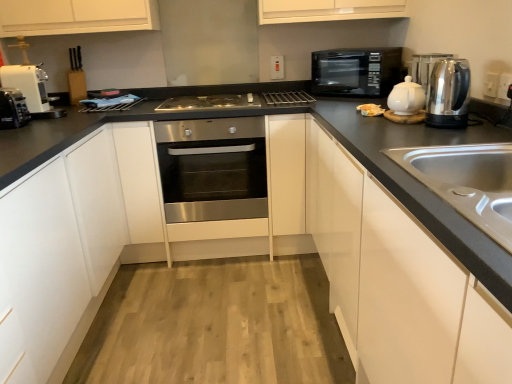
Question: Is white plastic toaster at left facing away from white plastic electric outlet at upper center, acting as the 1th electric outlet starting from the left?

Choices:
 (A) yes
 (B) no

Answer: (B)

Question: Can you confirm if white plastic toaster at left is positioned to the left of white plastic electric outlet at upper center, the first electric outlet from the top?

Choices:
 (A) no
 (B) yes

Answer: (B)

Question: Does white plastic toaster at left have a greater width compared to white plastic electric outlet at upper center, which is the 1th electric outlet in back-to-front order?

Choices:
 (A) yes
 (B) no

Answer: (A)

Question: From a real-world perspective, is white plastic toaster at left below white plastic electric outlet at upper center, which is the 1th electric outlet in back-to-front order?

Choices:
 (A) yes
 (B) no

Answer: (A)

Question: Is the depth of white plastic toaster at left greater than that of white plastic electric outlet at upper center, which is the 2th electric outlet in bottom-to-top order?

Choices:
 (A) no
 (B) yes

Answer: (A)

Question: From the image's perspective, is polished stainless steel kettle at right above or below white plastic toaster at left?

Choices:
 (A) below
 (B) above

Answer: (A)

Question: Considering the positions of point (465, 87) and point (15, 109), is point (465, 87) closer or farther from the camera than point (15, 109)?

Choices:
 (A) farther
 (B) closer

Answer: (B)

Question: Considering the positions of polished stainless steel kettle at right and white plastic toaster at left in the image, is polished stainless steel kettle at right wider or thinner than white plastic toaster at left?

Choices:
 (A) thin
 (B) wide

Answer: (A)

Question: Considering the relative positions of polished stainless steel kettle at right and white plastic toaster at left in the image provided, is polished stainless steel kettle at right to the left or to the right of white plastic toaster at left?

Choices:
 (A) left
 (B) right

Answer: (B)

Question: Is polished stainless steel kettle at right inside the boundaries of stainless steel sink at right, or outside?

Choices:
 (A) inside
 (B) outside

Answer: (B)

Question: Considering the positions of polished stainless steel kettle at right and stainless steel sink at right in the image, is polished stainless steel kettle at right taller or shorter than stainless steel sink at right?

Choices:
 (A) tall
 (B) short

Answer: (A)

Question: Relative to stainless steel sink at right, is polished stainless steel kettle at right in front or behind?

Choices:
 (A) front
 (B) behind

Answer: (B)

Question: Would you say polished stainless steel kettle at right is to the left or to the right of stainless steel sink at right in the picture?

Choices:
 (A) right
 (B) left

Answer: (A)

Question: Is point (4, 74) closer or farther from the camera than point (414, 72)?

Choices:
 (A) closer
 (B) farther

Answer: (B)

Question: Is white plastic coffee machine at left spatially inside satin silver kettle at upper right, or outside of it?

Choices:
 (A) outside
 (B) inside

Answer: (A)